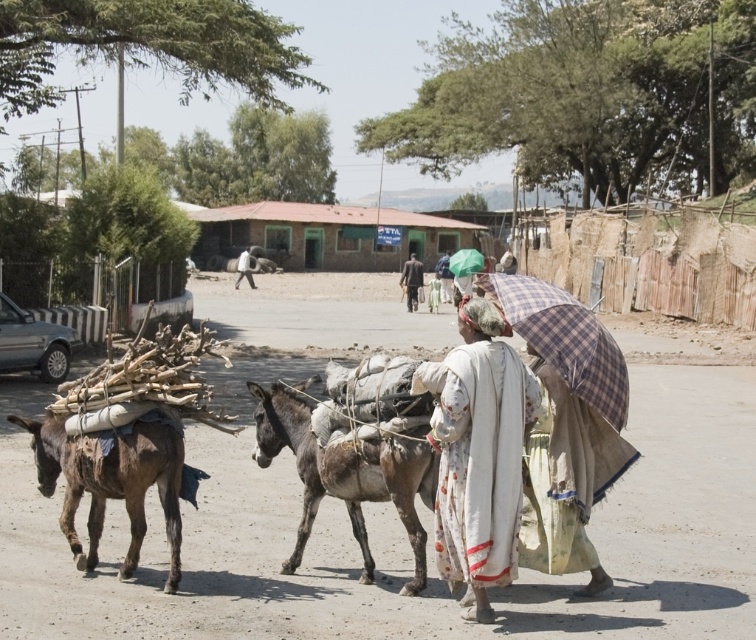
Does plaid fabric umbrella at lower right have a larger size compared to light brown fabric at center?

Incorrect, plaid fabric umbrella at lower right is not larger than light brown fabric at center.

Measure the distance between point (519, 541) and camera.

They are 6.96 meters apart.

At what (x,y) coordinates should I click in order to perform the action: click on plaid fabric umbrella at lower right. Please return your answer as a coordinate pair (x, y). Looking at the image, I should click on (567, 480).

Can you confirm if white cloth at center is shorter than plaid fabric umbrella at lower right?

No.

Identify the location of white cloth at center. (479, 452).

Is point (530, 394) positioned after point (600, 477)?

No, (530, 394) is in front of (600, 477).

Image resolution: width=756 pixels, height=640 pixels. I want to click on white cloth at center, so click(x=479, y=452).

Between plaid fabric umbrella at center and light brown fabric at center, which one is positioned lower?

plaid fabric umbrella at center is lower down.

Who is higher up, plaid fabric umbrella at center or light brown fabric at center?

Positioned higher is light brown fabric at center.

Consider the image. Who is more distant from viewer, (578, 336) or (240, 278)?

Positioned behind is point (240, 278).

The image size is (756, 640). In order to click on plaid fabric umbrella at center in this screenshot , I will do `click(565, 339)`.